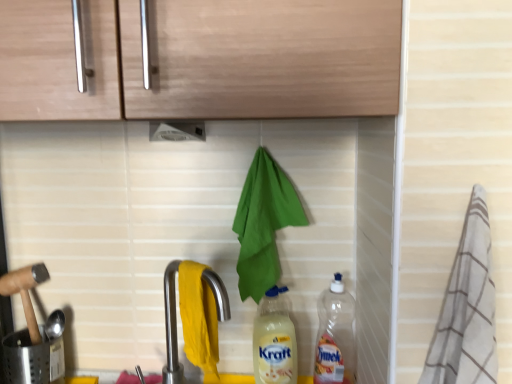
Describe the element at coordinates (263, 224) in the screenshot. I see `green fabric hand towel at center` at that location.

Measure the distance between point (245,281) and camera.

Point (245,281) is 36.38 inches away from camera.

This screenshot has height=384, width=512. I want to click on satin nickel faucet at lower center, so click(x=170, y=327).

Identify the location of green fabric hand towel at center. (263, 224).

Considering the sizes of satin nickel faucet at lower center and white plastic exhaust hood at upper center in the image, is satin nickel faucet at lower center bigger or smaller than white plastic exhaust hood at upper center?

A: In the image, satin nickel faucet at lower center appears to be larger than white plastic exhaust hood at upper center.

Considering the relative sizes of satin nickel faucet at lower center and white plastic exhaust hood at upper center in the image provided, is satin nickel faucet at lower center shorter than white plastic exhaust hood at upper center?

No, satin nickel faucet at lower center is not shorter than white plastic exhaust hood at upper center.

Is satin nickel faucet at lower center positioned behind white plastic exhaust hood at upper center?

No, satin nickel faucet at lower center is in front of white plastic exhaust hood at upper center.

Considering the points (247, 175) and (254, 362), which point is in front, point (247, 175) or point (254, 362)?

The point (247, 175) is closer to the camera.

Does green fabric hand towel at center have a larger size compared to matte plastic bottle at center, which is the 1th bottle from left to right?

Yes.

From a real-world perspective, which is physically above, green fabric hand towel at center or matte plastic bottle at center, the second bottle in the right-to-left sequence?

In real-world perspective, green fabric hand towel at center is above.

Could you tell me if green fabric hand towel at center is turned towards matte plastic bottle at center, which is the 1th bottle from left to right?

No, green fabric hand towel at center does not turn towards matte plastic bottle at center, which is the 1th bottle from left to right.

From a real-world perspective, is light wood cabinet at upper center positioned under satin nickel faucet at lower center based on gravity?

No, from a real-world perspective, light wood cabinet at upper center is not beneath satin nickel faucet at lower center.

Which of these two, light wood cabinet at upper center or satin nickel faucet at lower center, stands taller?

light wood cabinet at upper center.

What's the angular difference between light wood cabinet at upper center and satin nickel faucet at lower center's facing directions?

44.3 degrees separate the facing orientations of light wood cabinet at upper center and satin nickel faucet at lower center.

Based on the photo, can we say light wood cabinet at upper center lies outside satin nickel faucet at lower center?

Yes.

Based on the photo, from the image's perspective, does light wood cabinet at upper center appear higher than white striped towel at right?

Indeed, from the image's perspective, light wood cabinet at upper center is shown above white striped towel at right.

Would you say light wood cabinet at upper center is a long distance from white striped towel at right?

No, light wood cabinet at upper center is in close proximity to white striped towel at right.

Is the depth of light wood cabinet at upper center greater than that of white striped towel at right?

No, light wood cabinet at upper center is closer to the camera.

I want to click on material on the right side of light wood cabinet at upper center, so click(467, 308).

From the picture: In the image, is transparent plastic bottle at lower right, the 2th bottle when ordered from left to right, on the left side or the right side of white striped towel at right?

transparent plastic bottle at lower right, the 2th bottle when ordered from left to right, is positioned on white striped towel at right's left side.

Considering the sizes of objects transparent plastic bottle at lower right, the 2th bottle when ordered from left to right, and white striped towel at right in the image provided, who is smaller, transparent plastic bottle at lower right, the 2th bottle when ordered from left to right, or white striped towel at right?

transparent plastic bottle at lower right, the 2th bottle when ordered from left to right, is smaller.

From the image's perspective, does transparent plastic bottle at lower right, placed as the first bottle when sorted from right to left, appear higher than white striped towel at right?

No, from the image's perspective, transparent plastic bottle at lower right, placed as the first bottle when sorted from right to left, is not over white striped towel at right.

Considering the relative sizes of transparent plastic bottle at lower right, the 2th bottle when ordered from left to right, and green fabric hand towel at center in the image provided, is transparent plastic bottle at lower right, the 2th bottle when ordered from left to right, bigger than green fabric hand towel at center?

Incorrect, transparent plastic bottle at lower right, the 2th bottle when ordered from left to right, is not larger than green fabric hand towel at center.

Is transparent plastic bottle at lower right, the 2th bottle when ordered from left to right, facing away from green fabric hand towel at center?

That's not correct — transparent plastic bottle at lower right, the 2th bottle when ordered from left to right, is not looking away from green fabric hand towel at center.

Considering their positions, is transparent plastic bottle at lower right, the 2th bottle when ordered from left to right, located in front of or behind green fabric hand towel at center?

Clearly, transparent plastic bottle at lower right, the 2th bottle when ordered from left to right, is behind green fabric hand towel at center.

Is transparent plastic bottle at lower right, the 2th bottle when ordered from left to right, next to green fabric hand towel at center?

No.

From a real-world perspective, between white plastic exhaust hood at upper center and satin nickel faucet at lower center, who is vertically lower?

From a 3D spatial view, satin nickel faucet at lower center is below.

Is satin nickel faucet at lower center at the back of white plastic exhaust hood at upper center?

No, white plastic exhaust hood at upper center is not facing away from satin nickel faucet at lower center.

Who is smaller, white plastic exhaust hood at upper center or satin nickel faucet at lower center?

Result: white plastic exhaust hood at upper center is smaller.

Can you confirm if white plastic exhaust hood at upper center is positioned to the right of satin nickel faucet at lower center?

In fact, white plastic exhaust hood at upper center is to the left of satin nickel faucet at lower center.

Where is `tap on the right of white plastic exhaust hood at upper center`? Image resolution: width=512 pixels, height=384 pixels. tap on the right of white plastic exhaust hood at upper center is located at coordinates (170, 327).

Locate an element on the screen. hand towel on the left of the matte plastic bottle at center, the second bottle in the right-to-left sequence is located at coordinates (263, 224).

Which object lies nearer to the anchor point transparent plastic bottle at lower right, the 2th bottle when ordered from left to right, white plastic exhaust hood at upper center or light wood cabinet at upper center?

Among the two, white plastic exhaust hood at upper center is located nearer to transparent plastic bottle at lower right, the 2th bottle when ordered from left to right.

Based on their spatial positions, is transparent plastic bottle at lower right, placed as the first bottle when sorted from right to left, or satin nickel faucet at lower center closer to white striped towel at right?

transparent plastic bottle at lower right, placed as the first bottle when sorted from right to left.

Looking at the image, which one is located closer to light wood cabinet at upper center, matte plastic bottle at center, the second bottle in the right-to-left sequence, or white plastic exhaust hood at upper center?

Among the two, white plastic exhaust hood at upper center is located nearer to light wood cabinet at upper center.

Based on the photo, from the image, which object appears to be nearer to white striped towel at right, transparent plastic bottle at lower right, the 2th bottle when ordered from left to right, or white plastic exhaust hood at upper center?

The object closer to white striped towel at right is transparent plastic bottle at lower right, the 2th bottle when ordered from left to right.

Based on their spatial positions, is light wood cabinet at upper center or white striped towel at right closer to green fabric hand towel at center?

light wood cabinet at upper center is positioned closer to the anchor green fabric hand towel at center.

Looking at the image, which one is located further to matte plastic bottle at center, the second bottle in the right-to-left sequence, white plastic exhaust hood at upper center or green fabric hand towel at center?

Based on the image, white plastic exhaust hood at upper center appears to be further to matte plastic bottle at center, the second bottle in the right-to-left sequence.

Which object lies further to the anchor point transparent plastic bottle at lower right, the 2th bottle when ordered from left to right, matte plastic bottle at center, the second bottle in the right-to-left sequence, or white striped towel at right?

white striped towel at right is positioned further to the anchor transparent plastic bottle at lower right, the 2th bottle when ordered from left to right.

Based on their spatial positions, is matte plastic bottle at center, which is the 1th bottle from left to right, or white plastic exhaust hood at upper center further from white striped towel at right?

Among the two, white plastic exhaust hood at upper center is located further to white striped towel at right.

The image size is (512, 384). I want to click on material between light wood cabinet at upper center and transparent plastic bottle at lower right, the 2th bottle when ordered from left to right, in the up-down direction, so click(467, 308).

Find the location of a particular element. hand towel between white plastic exhaust hood at upper center and transparent plastic bottle at lower right, placed as the first bottle when sorted from right to left, from top to bottom is located at coordinates (263, 224).

At what (x,y) coordinates should I click in order to perform the action: click on tap between white plastic exhaust hood at upper center and transparent plastic bottle at lower right, placed as the first bottle when sorted from right to left, in the up-down direction. Please return your answer as a coordinate pair (x, y). Looking at the image, I should click on (170, 327).

Locate an element on the screen. bottle between light wood cabinet at upper center and matte plastic bottle at center, the second bottle in the right-to-left sequence, in the vertical direction is located at coordinates (335, 336).